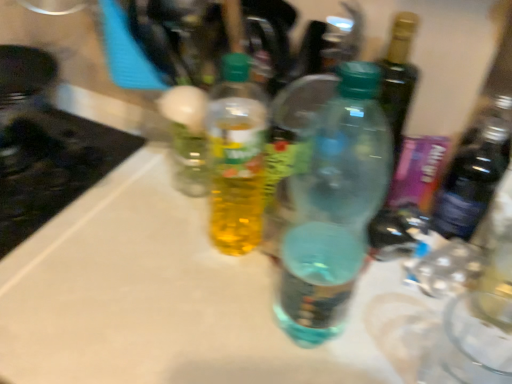
At what (x,y) coordinates should I click in order to perform the action: click on unoccupied area behind translucent plastic bottle at center, positioned as the first bottle in left-to-right order. Please return your answer as a coordinate pair (x, y). This screenshot has height=384, width=512. Looking at the image, I should click on (201, 196).